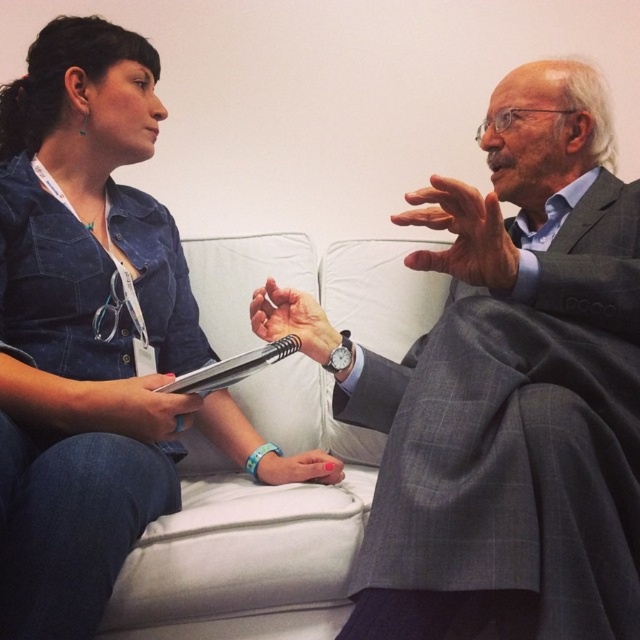
Can you confirm if gray checkered suit at center is positioned to the right of denim jacket at upper left?

Correct, you'll find gray checkered suit at center to the right of denim jacket at upper left.

Between gray checkered suit at center and denim jacket at upper left, which one appears on the left side from the viewer's perspective?

denim jacket at upper left

Is point (577, 401) less distant than point (150, 125)?

Yes, it is in front of point (150, 125).

At what (x,y) coordinates should I click in order to perform the action: click on gray checkered suit at center. Please return your answer as a coordinate pair (x, y). Looking at the image, I should click on (506, 388).